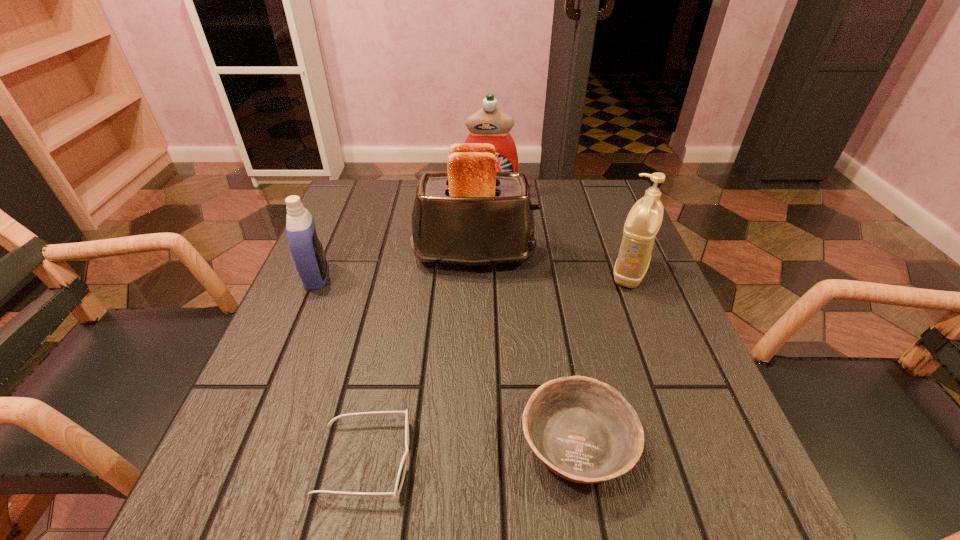
Locate an element on the screen. object that is at the near left corner is located at coordinates (402, 469).

The image size is (960, 540). What are the coordinates of `object located at the near right corner` in the screenshot? It's located at (583, 430).

You are a GUI agent. You are given a task and a screenshot of the screen. Output one action in this format:
    pyautogui.click(x=<x>, y=<y>)
    Task: Click on the vacant space at the far edge of the desktop
    The image size is (960, 540).
    Given the screenshot: What is the action you would take?
    (x=532, y=197)

Identify the location of vacant point at the near edge. (433, 489).

This screenshot has height=540, width=960. Find the location of `vacant space at the left edge`. vacant space at the left edge is located at coordinates (337, 364).

Where is `blank space at the right edge of the desktop`? This screenshot has height=540, width=960. blank space at the right edge of the desktop is located at coordinates (586, 267).

The width and height of the screenshot is (960, 540). I want to click on vacant space at the far left corner of the desktop, so click(393, 205).

The width and height of the screenshot is (960, 540). Find the location of `vacant space at the far right corner of the desktop`. vacant space at the far right corner of the desktop is located at coordinates (577, 225).

Image resolution: width=960 pixels, height=540 pixels. I want to click on vacant space at the near right corner of the desktop, so click(x=745, y=486).

The height and width of the screenshot is (540, 960). Find the location of `empty space that is in between the sunglasses and the tallest detergent`. empty space that is in between the sunglasses and the tallest detergent is located at coordinates (426, 327).